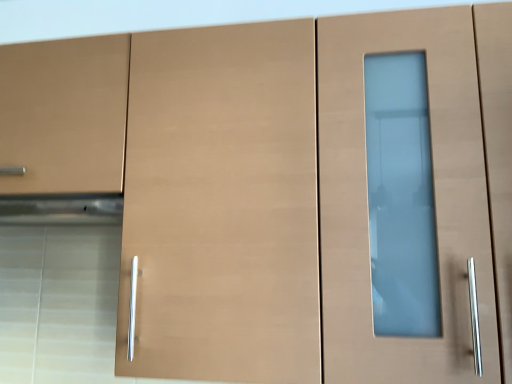
Question: Based on their sizes in the image, would you say satin silver exhaust hood at left is bigger or smaller than matte wood drawer at left?

Choices:
 (A) small
 (B) big

Answer: (A)

Question: Considering the relative positions of satin silver exhaust hood at left and matte wood drawer at left in the image provided, is satin silver exhaust hood at left to the left or to the right of matte wood drawer at left?

Choices:
 (A) right
 (B) left

Answer: (A)

Question: From the image's perspective, relative to matte wood drawer at left, is satin silver exhaust hood at left above or below?

Choices:
 (A) above
 (B) below

Answer: (B)

Question: Based on their sizes in the image, would you say matte wood drawer at left is bigger or smaller than satin silver exhaust hood at left?

Choices:
 (A) big
 (B) small

Answer: (A)

Question: Is matte wood drawer at left taller or shorter than satin silver exhaust hood at left?

Choices:
 (A) short
 (B) tall

Answer: (B)

Question: Does point (22, 193) appear closer or farther from the camera than point (55, 203)?

Choices:
 (A) farther
 (B) closer

Answer: (B)

Question: Would you say matte wood drawer at left is to the left or to the right of satin silver exhaust hood at left in the picture?

Choices:
 (A) left
 (B) right

Answer: (A)